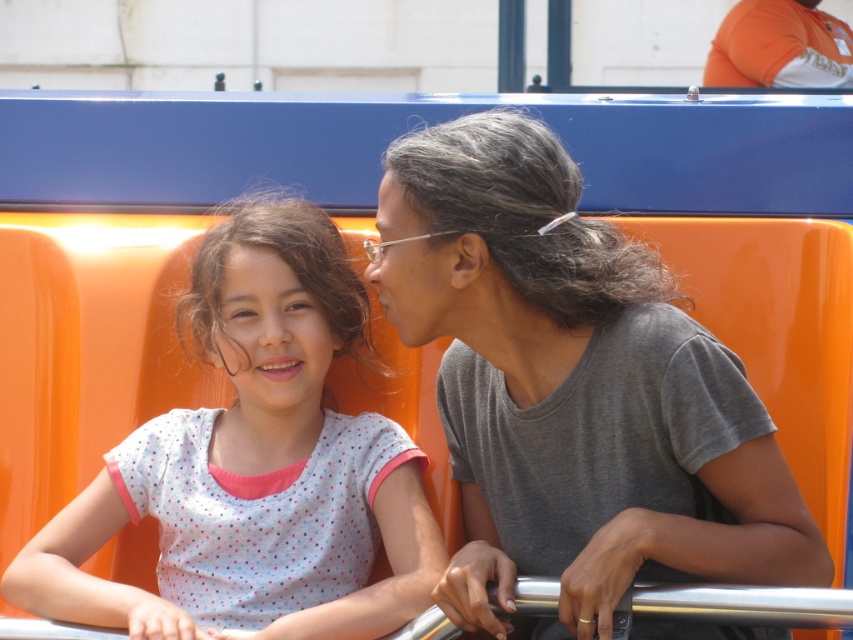
The width and height of the screenshot is (853, 640). I want to click on gray matte hair at center, so click(x=573, y=388).

Describe the element at coordinates (573, 388) in the screenshot. I see `gray matte hair at center` at that location.

Identify the location of gray matte hair at center. (573, 388).